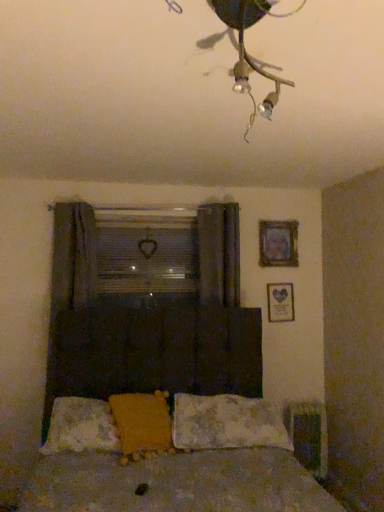
Question: Is clear plastic window screen at center completely or partially inside fluffy white pillow at lower center, the first pillow from the left?

Choices:
 (A) no
 (B) yes

Answer: (A)

Question: Is the position of fluffy white pillow at lower center, which appears as the third pillow when viewed from the right, more distant than that of clear plastic window screen at center?

Choices:
 (A) no
 (B) yes

Answer: (A)

Question: Would you say fluffy white pillow at lower center, the first pillow from the left, is outside clear plastic window screen at center?

Choices:
 (A) no
 (B) yes

Answer: (B)

Question: Can you confirm if fluffy white pillow at lower center, the first pillow from the left, is positioned to the right of clear plastic window screen at center?

Choices:
 (A) no
 (B) yes

Answer: (A)

Question: Can you confirm if fluffy white pillow at lower center, the first pillow from the left, is bigger than clear plastic window screen at center?

Choices:
 (A) yes
 (B) no

Answer: (A)

Question: From a real-world perspective, is metallic wire at upper center above or below wooden picture frame at upper right, which is the 1th picture frame in top-to-bottom order?

Choices:
 (A) above
 (B) below

Answer: (A)

Question: Is point (251, 58) positioned closer to the camera than point (292, 237)?

Choices:
 (A) closer
 (B) farther

Answer: (A)

Question: Looking at their shapes, would you say metallic wire at upper center is wider or thinner than wooden picture frame at upper right, marked as the 2th picture frame in a bottom-to-top arrangement?

Choices:
 (A) wide
 (B) thin

Answer: (A)

Question: From the image's perspective, is metallic wire at upper center located above or below wooden picture frame at upper right, marked as the 2th picture frame in a bottom-to-top arrangement?

Choices:
 (A) below
 (B) above

Answer: (B)

Question: Would you say fluffy white pillow at lower center, the first pillow from the left, is inside or outside fluffy white pillow at center, the third pillow when ordered from left to right?

Choices:
 (A) inside
 (B) outside

Answer: (B)

Question: Considering the positions of point click(x=69, y=411) and point click(x=231, y=420), is point click(x=69, y=411) closer or farther from the camera than point click(x=231, y=420)?

Choices:
 (A) farther
 (B) closer

Answer: (B)

Question: Is fluffy white pillow at lower center, the first pillow from the left, bigger or smaller than fluffy white pillow at center, the third pillow when ordered from left to right?

Choices:
 (A) small
 (B) big

Answer: (A)

Question: Based on their positions, is fluffy white pillow at lower center, the first pillow from the left, located to the left or right of fluffy white pillow at center, placed as the first pillow when sorted from right to left?

Choices:
 (A) left
 (B) right

Answer: (A)

Question: In terms of width, does yellow fuzzy pillow at center, acting as the 2th pillow starting from the left, look wider or thinner when compared to dark fabric curtain at left, which appears as the 1th curtain when viewed from the left?

Choices:
 (A) wide
 (B) thin

Answer: (A)

Question: Is yellow fuzzy pillow at center, placed as the 2th pillow when sorted from right to left, bigger or smaller than dark fabric curtain at left, which appears as the 1th curtain when viewed from the left?

Choices:
 (A) small
 (B) big

Answer: (A)